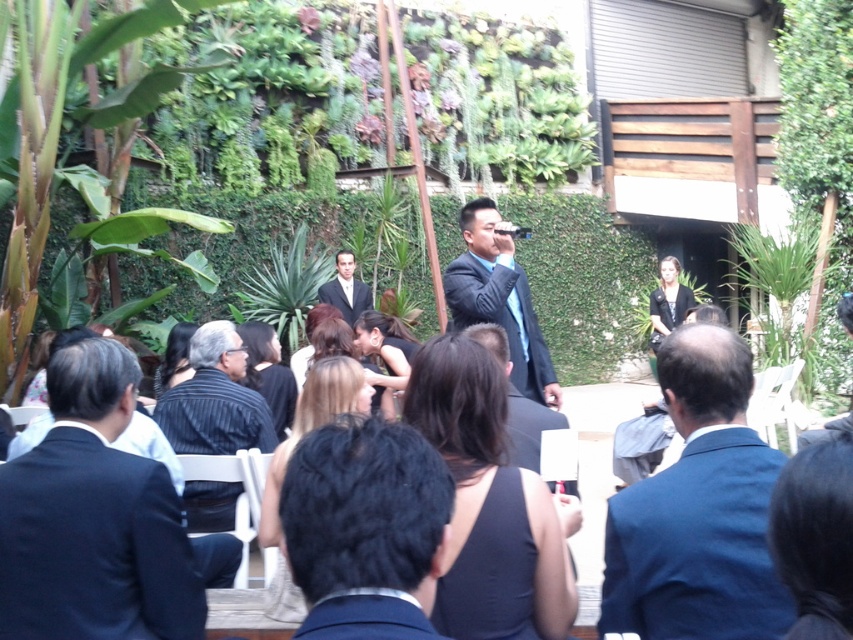
You are a photographer at the event and need to capture a clear photo of both the striped shirt at center and the striped fabric shirt at center. Which one should you focus on to ensure it appears larger in the photo?

The striped shirt at center is much taller than the striped fabric shirt at center, so focusing on it will make it appear larger in the photo.

You are a photographer at the event and need to adjust the camera focus. Which clothing item, the striped shirt at center or the black fabric dress at center, requires a closer focus due to its smaller size?

The striped shirt at center requires closer focus because it has a smaller size compared to the black fabric dress at center.